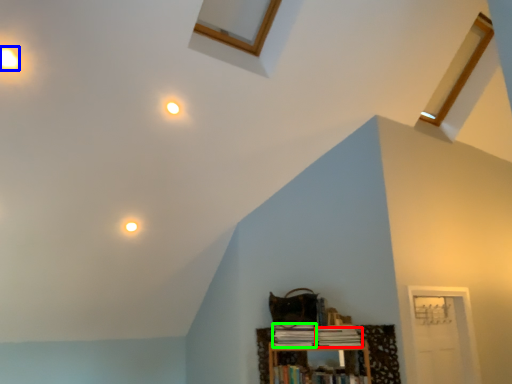
Question: Considering the real-world distances, which object is farthest from book (highlighted by a red box)? dot (highlighted by a blue box) or book (highlighted by a green box)?

Choices:
 (A) dot
 (B) book

Answer: (A)